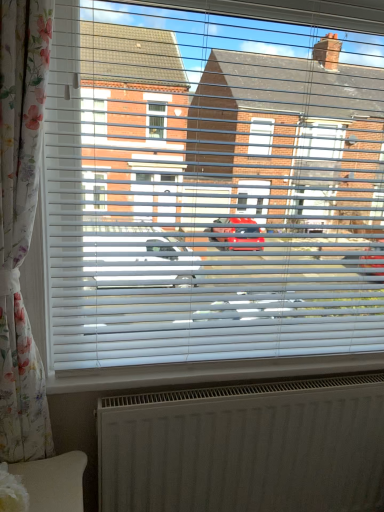
Question: Is white plastic blinds at center wider than white textured radiator at lower center?

Choices:
 (A) yes
 (B) no

Answer: (A)

Question: From the image's perspective, is white plastic blinds at center above white textured radiator at lower center?

Choices:
 (A) yes
 (B) no

Answer: (A)

Question: Is white plastic blinds at center further to the viewer compared to white textured radiator at lower center?

Choices:
 (A) no
 (B) yes

Answer: (A)

Question: Does white plastic blinds at center have a lesser height compared to white textured radiator at lower center?

Choices:
 (A) yes
 (B) no

Answer: (B)

Question: Is white plastic blinds at center facing towards white textured radiator at lower center?

Choices:
 (A) yes
 (B) no

Answer: (B)

Question: Is white textured radiator at lower center located within white plastic blinds at center?

Choices:
 (A) yes
 (B) no

Answer: (B)

Question: Does white plastic blinds at center appear on the right side of floral fabric curtain at left?

Choices:
 (A) no
 (B) yes

Answer: (B)

Question: Is white plastic blinds at center to the left of floral fabric curtain at left from the viewer's perspective?

Choices:
 (A) no
 (B) yes

Answer: (A)

Question: Is floral fabric curtain at left surrounded by white plastic blinds at center?

Choices:
 (A) yes
 (B) no

Answer: (B)

Question: From a real-world perspective, is white plastic blinds at center located higher than floral fabric curtain at left?

Choices:
 (A) yes
 (B) no

Answer: (A)

Question: Can you confirm if white plastic blinds at center is shorter than floral fabric curtain at left?

Choices:
 (A) yes
 (B) no

Answer: (A)

Question: Does white plastic blinds at center have a greater height compared to floral fabric curtain at left?

Choices:
 (A) yes
 (B) no

Answer: (B)

Question: Does floral fabric curtain at left have a larger size compared to white textured radiator at lower center?

Choices:
 (A) yes
 (B) no

Answer: (B)